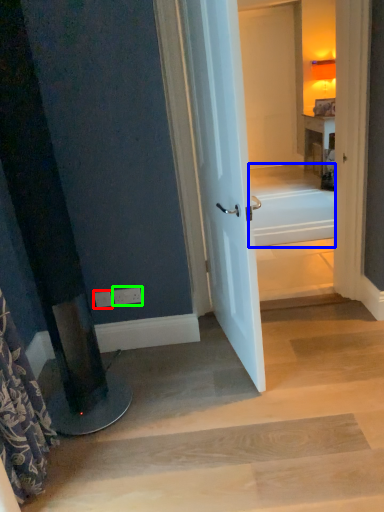
Question: Which object is the farthest from electric outlet (highlighted by a red box)? Choose among these: bath (highlighted by a blue box) or electric outlet (highlighted by a green box).

Choices:
 (A) bath
 (B) electric outlet

Answer: (A)